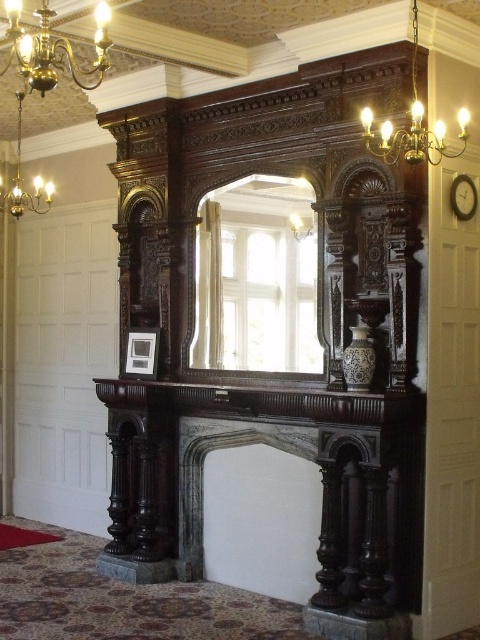
Can you confirm if dark wood fireplace at center is smaller than gold metallic chandelier at upper left?

Actually, dark wood fireplace at center might be larger than gold metallic chandelier at upper left.

The width and height of the screenshot is (480, 640). What do you see at coordinates (203, 468) in the screenshot?
I see `dark wood fireplace at center` at bounding box center [203, 468].

Identify the location of dark wood fireplace at center. Image resolution: width=480 pixels, height=640 pixels. (203, 468).

Does point (229, 368) come in front of point (298, 214)?

No.

Does polished wood mirror at center appear under matte gold lamp at upper center?

Yes.

The image size is (480, 640). Describe the element at coordinates (255, 278) in the screenshot. I see `polished wood mirror at center` at that location.

You are a GUI agent. You are given a task and a screenshot of the screen. Output one action in this format:
    pyautogui.click(x=<x>, y=<y>)
    Task: Click on the polished wood mirror at center
    This screenshot has height=640, width=480.
    Given the screenshot: What is the action you would take?
    pyautogui.click(x=255, y=278)

Is polished wood mirror at center shorter than gold metallic chandelier at upper left?

No, polished wood mirror at center is not shorter than gold metallic chandelier at upper left.

Image resolution: width=480 pixels, height=640 pixels. What do you see at coordinates (255, 278) in the screenshot? I see `polished wood mirror at center` at bounding box center [255, 278].

Image resolution: width=480 pixels, height=640 pixels. In order to click on polished wood mirror at center in this screenshot , I will do `click(255, 278)`.